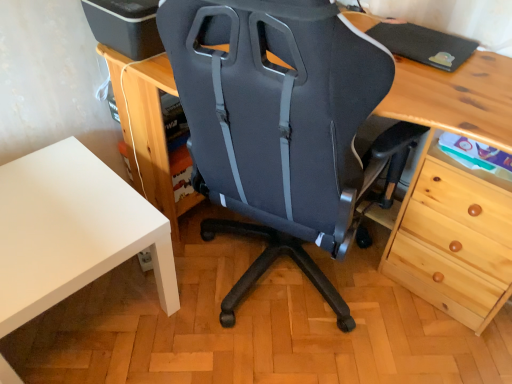
Question: Considering the positions of white matte table at lower left and matte black chair at center in the image, is white matte table at lower left wider or thinner than matte black chair at center?

Choices:
 (A) thin
 (B) wide

Answer: (A)

Question: Considering their positions, is white matte table at lower left located in front of or behind matte black chair at center?

Choices:
 (A) behind
 (B) front

Answer: (A)

Question: Is point (103, 168) closer or farther from the camera than point (316, 28)?

Choices:
 (A) farther
 (B) closer

Answer: (A)

Question: Based on their positions, is matte black chair at center located to the left or right of white matte table at lower left?

Choices:
 (A) right
 (B) left

Answer: (A)

Question: From the image's perspective, is matte black chair at center located above or below white matte table at lower left?

Choices:
 (A) above
 (B) below

Answer: (A)

Question: From a real-world perspective, is matte black chair at center positioned above or below white matte table at lower left?

Choices:
 (A) above
 (B) below

Answer: (A)

Question: Do you think matte black chair at center is within white matte table at lower left, or outside of it?

Choices:
 (A) outside
 (B) inside

Answer: (A)